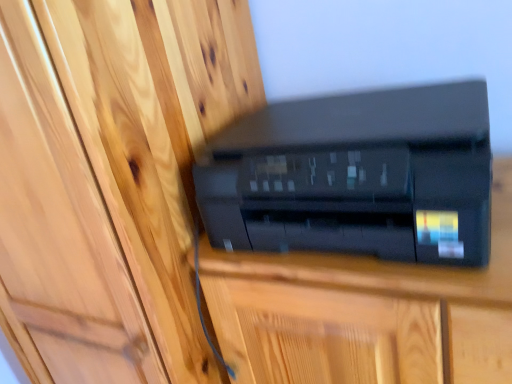
Question: Can you confirm if matte wood door at center is positioned to the right of black plastic printer at center?

Choices:
 (A) no
 (B) yes

Answer: (A)

Question: Is matte wood door at center facing towards black plastic printer at center?

Choices:
 (A) no
 (B) yes

Answer: (A)

Question: Is matte wood door at center positioned beyond the bounds of black plastic printer at center?

Choices:
 (A) no
 (B) yes

Answer: (B)

Question: Does matte wood door at center have a lesser height compared to black plastic printer at center?

Choices:
 (A) no
 (B) yes

Answer: (A)

Question: Is matte wood door at center oriented away from black plastic printer at center?

Choices:
 (A) no
 (B) yes

Answer: (A)

Question: Considering the positions of black plastic printer at center and matte wood door at center in the image, is black plastic printer at center taller or shorter than matte wood door at center?

Choices:
 (A) short
 (B) tall

Answer: (A)

Question: Considering their positions, is black plastic printer at center located in front of or behind matte wood door at center?

Choices:
 (A) behind
 (B) front

Answer: (A)

Question: From a real-world perspective, is black plastic printer at center positioned above or below matte wood door at center?

Choices:
 (A) above
 (B) below

Answer: (A)

Question: Would you say black plastic printer at center is to the left or to the right of matte wood door at center in the picture?

Choices:
 (A) left
 (B) right

Answer: (B)

Question: From the image's perspective, relative to black plastic printer at center, is matte wood door at center above or below?

Choices:
 (A) below
 (B) above

Answer: (B)

Question: Is matte wood door at center in front of or behind black plastic printer at center in the image?

Choices:
 (A) front
 (B) behind

Answer: (A)

Question: Is point (41, 336) positioned closer to the camera than point (508, 195)?

Choices:
 (A) farther
 (B) closer

Answer: (A)

Question: Which is correct: matte wood door at center is inside black plastic printer at center, or outside of it?

Choices:
 (A) outside
 (B) inside

Answer: (A)

Question: Is black plastic printer at center to the left or to the right of black plastic printer at center in the image?

Choices:
 (A) left
 (B) right

Answer: (A)

Question: Choose the correct answer: Is black plastic printer at center inside black plastic printer at center or outside it?

Choices:
 (A) inside
 (B) outside

Answer: (B)